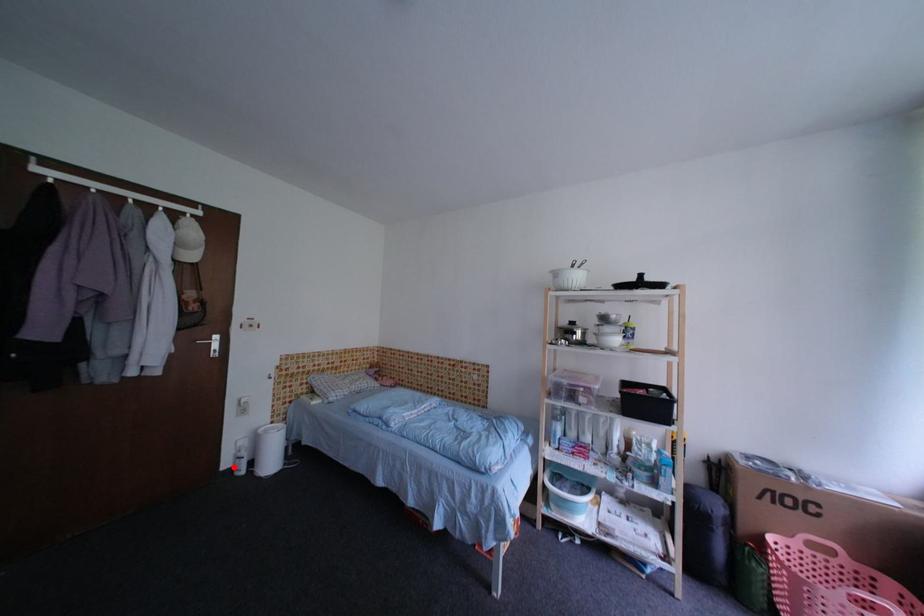
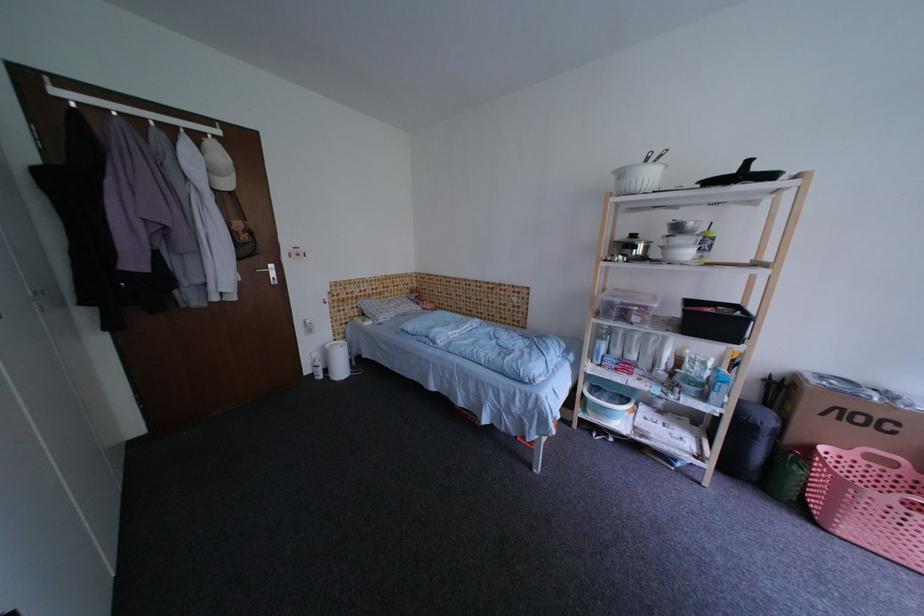
Question: I am providing you with two images of the same scene from different viewpoints. A red point is marked on the first image. Can you still see the location of the red point in image 2?

Choices:
 (A) Yes
 (B) No

Answer: (A)